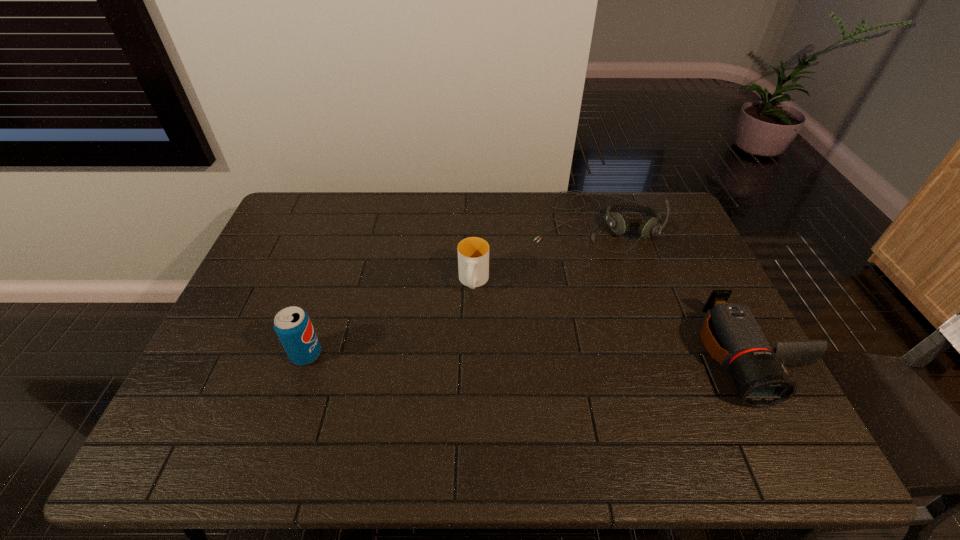
This screenshot has width=960, height=540. I want to click on the tallest object, so click(x=292, y=324).

The height and width of the screenshot is (540, 960). In order to click on soda can in this screenshot , I will do click(292, 324).

The image size is (960, 540). Find the location of `camcorder`. camcorder is located at coordinates (730, 333).

I want to click on the farthest object, so click(618, 222).

At what (x,y) coordinates should I click in order to perform the action: click on cup. Please return your answer as a coordinate pair (x, y). The image size is (960, 540). Looking at the image, I should click on (473, 253).

Identify the location of the second object from left to right. This screenshot has height=540, width=960. 473,253.

You are a GUI agent. You are given a task and a screenshot of the screen. Output one action in this format:
    pyautogui.click(x=<x>, y=<y>)
    Task: Click on the vacant space located on the right of the leftmost object
    This screenshot has height=540, width=960.
    Given the screenshot: What is the action you would take?
    pyautogui.click(x=380, y=354)

At what (x,y) coordinates should I click in order to perform the action: click on free region located 0.180m on the outer surface of the farthest object. Please return your answer as a coordinate pair (x, y). The height and width of the screenshot is (540, 960). Looking at the image, I should click on (580, 292).

The image size is (960, 540). What are the coordinates of `vacant space located on the outer surface of the farthest object` in the screenshot? It's located at (571, 346).

Locate an element on the screen. The height and width of the screenshot is (540, 960). vacant region located 0.190m on the outer surface of the farthest object is located at coordinates click(579, 294).